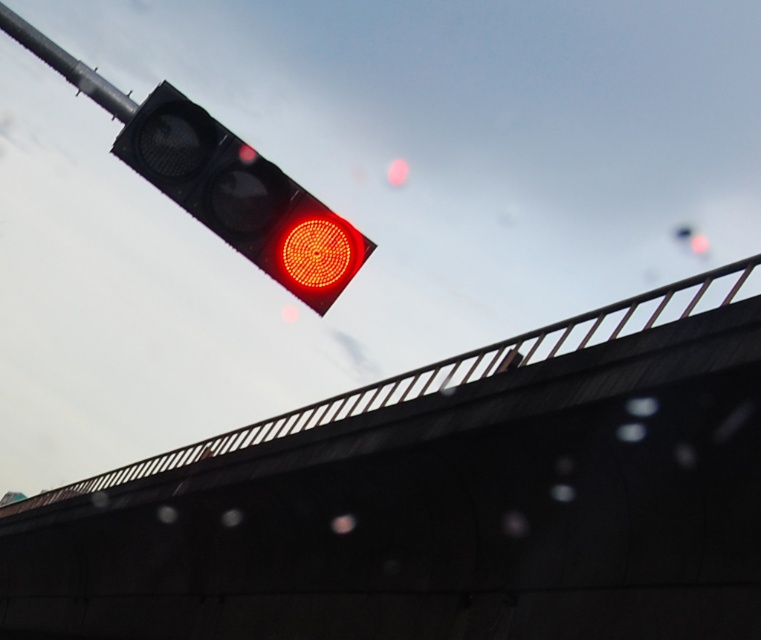
Question: Does black metal overpass at upper center have a larger size compared to matte black traffic light at upper center?

Choices:
 (A) no
 (B) yes

Answer: (B)

Question: Estimate the real-world distances between objects in this image. Which object is farther from the matte black traffic light at upper center?

Choices:
 (A) black metal overpass at upper center
 (B) metallic pole at upper left

Answer: (A)

Question: Which of the following is the closest to the observer?

Choices:
 (A) (228, 141)
 (B) (408, 513)

Answer: (A)

Question: Considering the relative positions of black metal overpass at upper center and metallic pole at upper left in the image provided, where is black metal overpass at upper center located with respect to metallic pole at upper left?

Choices:
 (A) below
 (B) above

Answer: (A)

Question: Which point is farther from the camera taking this photo?

Choices:
 (A) (358, 237)
 (B) (326, 552)
 (C) (78, 68)

Answer: (B)

Question: Is matte black traffic light at upper center thinner than metallic pole at upper left?

Choices:
 (A) no
 (B) yes

Answer: (A)